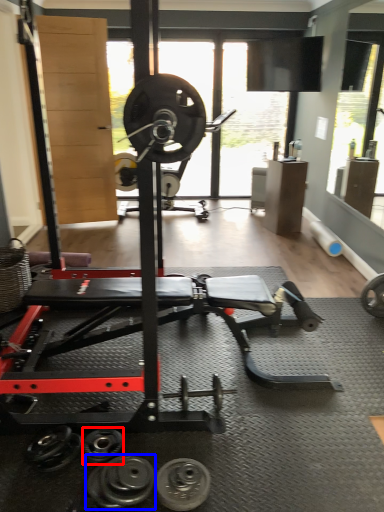
Question: Among these objects, which one is nearest to the camera, dumbbell (highlighted by a red box) or dumbbell (highlighted by a blue box)?

Choices:
 (A) dumbbell
 (B) dumbbell

Answer: (B)